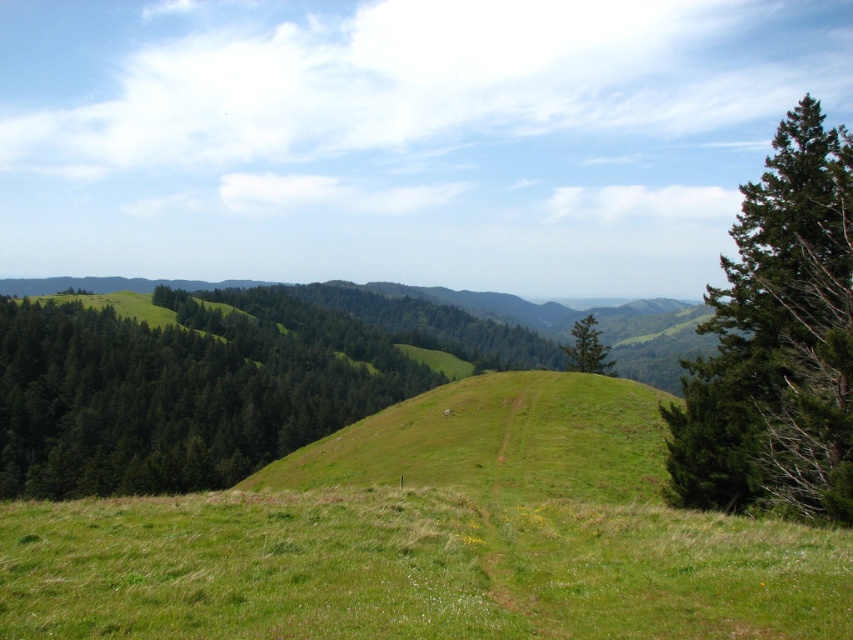
Question: Which object is the farthest from the green matte tree at left?

Choices:
 (A) green textured tree at center
 (B) green needle-like at right

Answer: (B)

Question: Which of the following is the closest to the observer?

Choices:
 (A) (577, 365)
 (B) (315, 368)

Answer: (A)

Question: Can you confirm if green matte tree at left is positioned below green needle-like at right?

Choices:
 (A) no
 (B) yes

Answer: (B)

Question: Is green matte tree at left above green needle-like at right?

Choices:
 (A) yes
 (B) no

Answer: (B)

Question: Which is nearer to the green needle-like at right?

Choices:
 (A) green matte tree at left
 (B) green textured tree at center

Answer: (B)

Question: Is green matte tree at left wider than green textured tree at center?

Choices:
 (A) no
 (B) yes

Answer: (B)